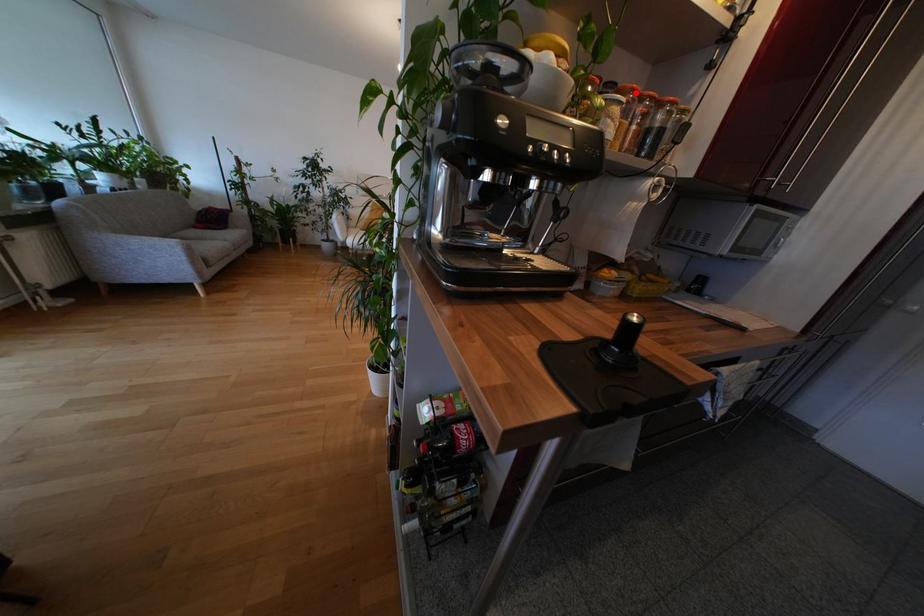
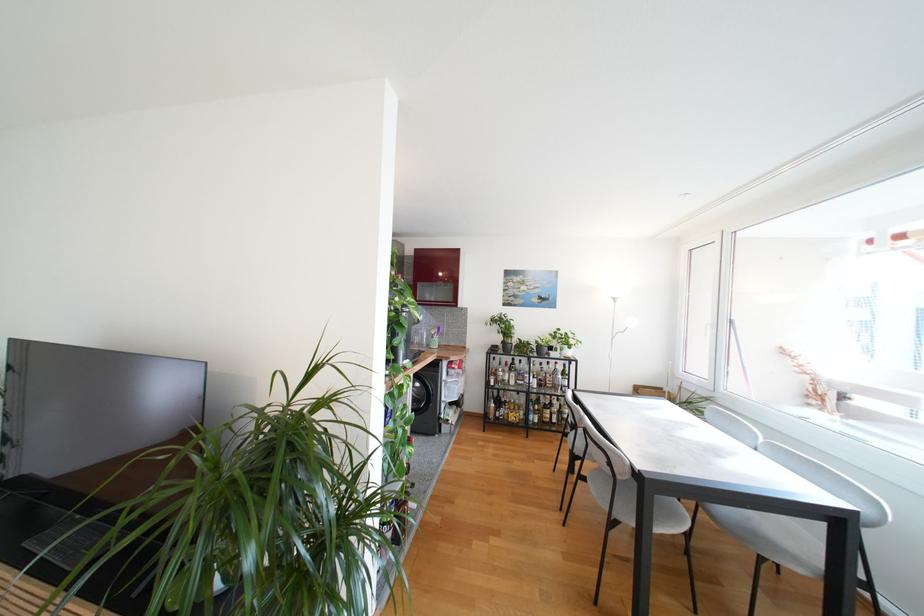
Question: I am providing you with two images of the same scene from different viewpoints. A red point is marked on the first image. Is the red point's position out of view in image 2?

Choices:
 (A) Yes
 (B) No

Answer: (A)